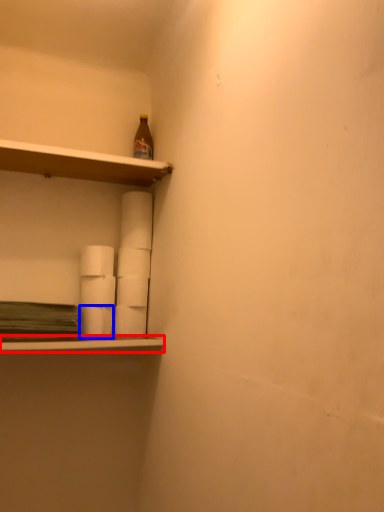
Question: Which object is closer to the camera taking this photo, ledge (highlighted by a red box) or paper towel (highlighted by a blue box)?

Choices:
 (A) ledge
 (B) paper towel

Answer: (A)